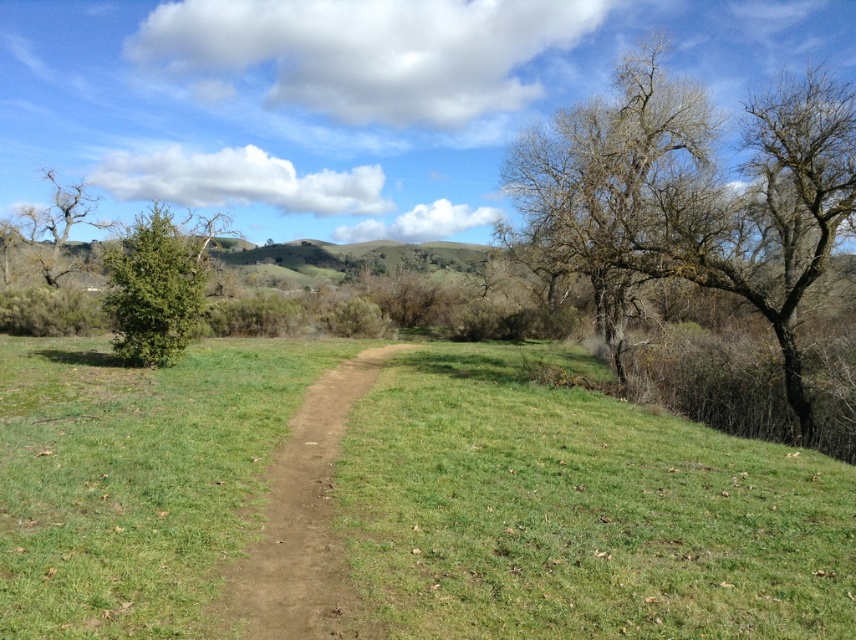
This screenshot has height=640, width=856. What do you see at coordinates (608, 180) in the screenshot?
I see `bare branches at upper right` at bounding box center [608, 180].

Between point (530, 145) and point (242, 625), which one is positioned in front?

Point (242, 625) is in front.

Locate an element on the screen. This screenshot has width=856, height=640. bare branches at upper right is located at coordinates (608, 180).

Does brown dirt track at center have a larger size compared to green matte tree at left?

Incorrect, brown dirt track at center is not larger than green matte tree at left.

Looking at this image, does brown dirt track at center come in front of green matte tree at left?

Yes.

Who is more distant from viewer, (306,525) or (150,214)?

The point (150,214) is more distant.

This screenshot has height=640, width=856. What are the coordinates of `brown dirt track at center` in the screenshot? It's located at (299, 522).

Is bare branches at upper right shorter than green matte tree at left?

No, bare branches at upper right is not shorter than green matte tree at left.

Image resolution: width=856 pixels, height=640 pixels. In order to click on bare branches at upper right in this screenshot , I will do `click(608, 180)`.

Does point (593, 198) come closer to viewer compared to point (123, 273)?

No, it is behind (123, 273).

I want to click on bare branches at upper right, so click(608, 180).